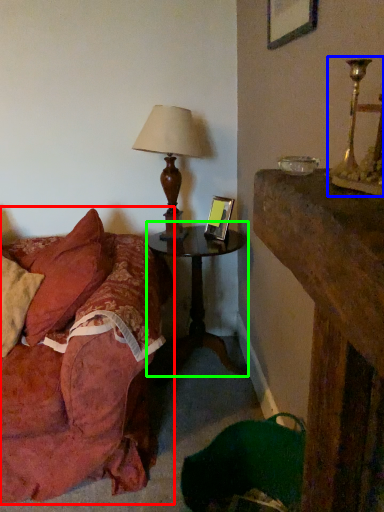
Question: Estimate the real-world distances between objects in this image. Which object is farther from studio couch (highlighted by a red box), candle holder (highlighted by a blue box) or nightstand (highlighted by a green box)?

Choices:
 (A) candle holder
 (B) nightstand

Answer: (A)